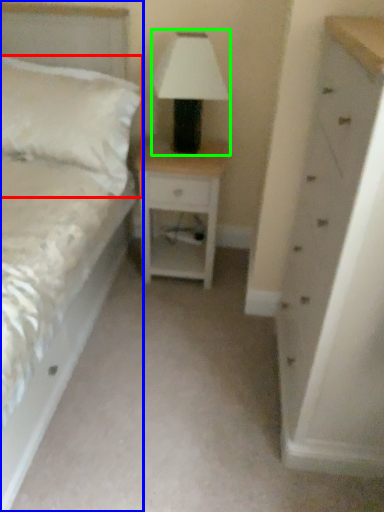
Question: Which object is the closest to the pillow (highlighted by a red box)? Choose among these: bed (highlighted by a blue box) or table lamp (highlighted by a green box).

Choices:
 (A) bed
 (B) table lamp

Answer: (B)